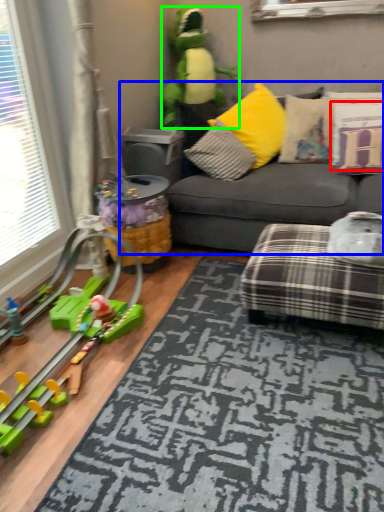
Question: Which is nearer to the pillow (highlighted by a red box)? studio couch (highlighted by a blue box) or toy (highlighted by a green box).

Choices:
 (A) studio couch
 (B) toy

Answer: (A)